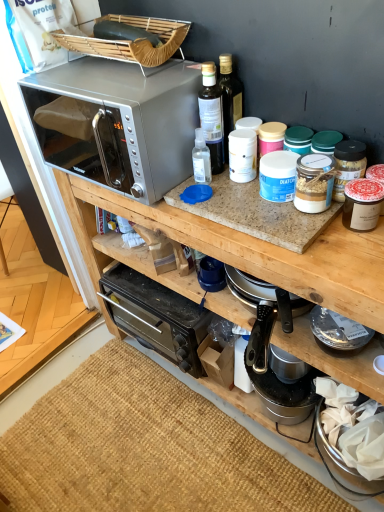
Find the location of a particular element. matte glass jar at right, which is the first appliance from top to bottom is located at coordinates tap(362, 204).

How much space does metallic silver coffee maker at center, which is the first appliance in back-to-front order, occupy horizontally?

metallic silver coffee maker at center, which is the first appliance in back-to-front order, is 8.22 inches in width.

Where is `metallic silver coffee maker at center, which ranks as the 2th appliance in top-to-bottom order`? The height and width of the screenshot is (512, 384). metallic silver coffee maker at center, which ranks as the 2th appliance in top-to-bottom order is located at coordinates (276, 376).

At what (x,y) coordinates should I click in order to perform the action: click on translucent glass bottle at upper center, marked as the second bottle in a left-to-right arrangement. Please return your answer as a coordinate pair (x, y). The image size is (384, 512). Looking at the image, I should click on (230, 98).

In order to click on satin silver microwave at upper left in this screenshot , I will do `click(117, 122)`.

Describe the element at coordinates (144, 449) in the screenshot. This screenshot has width=384, height=512. I see `burlap mat at lower center` at that location.

I want to click on matte glass jar at right, the first appliance positioned from the front, so pyautogui.click(x=362, y=204).

From the image's perspective, between satin silver microwave at upper left and matte glass jar at right, the second appliance from the back, which one is located above?

satin silver microwave at upper left appears higher in the image.

From a real-world perspective, is satin silver microwave at upper left below matte glass jar at right, which is the first appliance from top to bottom?

No, from a real-world perspective, satin silver microwave at upper left is not beneath matte glass jar at right, which is the first appliance from top to bottom.

Considering the positions of objects satin silver microwave at upper left and matte glass jar at right, positioned as the 2th appliance in bottom-to-top order, in the image provided, who is more to the left, satin silver microwave at upper left or matte glass jar at right, positioned as the 2th appliance in bottom-to-top order,?

satin silver microwave at upper left.

Does point (52, 101) appear closer or farther from the camera than point (361, 207)?

Point (52, 101).

Is silver metallic microwave at upper left completely or partially inside matte glass jar at right, the first appliance positioned from the front?

Definitely not — silver metallic microwave at upper left is not inside matte glass jar at right, the first appliance positioned from the front.

Who is taller, matte glass jar at right, the first appliance positioned from the front, or silver metallic microwave at upper left?

silver metallic microwave at upper left.

Which point is more forward, (374, 189) or (341, 362)?

The point (374, 189) is in front.

How much distance is there between matte glass jar at right, the first appliance positioned from the front, and silver metallic microwave at upper left?

They are 14.00 inches apart.

Is metallic silver coffee maker at center, which ranks as the 2th appliance in top-to-bottom order, positioned with its back to satin silver microwave at upper left?

That's not correct — metallic silver coffee maker at center, which ranks as the 2th appliance in top-to-bottom order, is not looking away from satin silver microwave at upper left.

Can you tell me how much metallic silver coffee maker at center, which is the 2th appliance from front to back, and satin silver microwave at upper left differ in facing direction?

The facing directions of metallic silver coffee maker at center, which is the 2th appliance from front to back, and satin silver microwave at upper left are 0.000352 degrees apart.

Is metallic silver coffee maker at center, which is the first appliance from bottom to top, located outside satin silver microwave at upper left?

Yes, metallic silver coffee maker at center, which is the first appliance from bottom to top, is outside of satin silver microwave at upper left.

Which object is closer to the camera taking this photo, metallic silver coffee maker at center, which is the first appliance in back-to-front order, or satin silver microwave at upper left?

satin silver microwave at upper left is closer to the camera.

From the image's perspective, between satin silver microwave at upper left and metallic silver coffee maker at center, which ranks as the 2th appliance in top-to-bottom order, which one is located above?

satin silver microwave at upper left is shown above in the image.

Where is `microwave oven lying on the left of metallic silver coffee maker at center, which is the first appliance from bottom to top`? This screenshot has width=384, height=512. microwave oven lying on the left of metallic silver coffee maker at center, which is the first appliance from bottom to top is located at coordinates (117, 122).

Is satin silver microwave at upper left turned away from metallic silver coffee maker at center, which ranks as the 2th appliance in top-to-bottom order?

No.

Considering the sizes of objects translucent glass bottle at upper center, which appears as the 1th bottle when viewed from the right, and satin silver microwave at upper left in the image provided, who is smaller, translucent glass bottle at upper center, which appears as the 1th bottle when viewed from the right, or satin silver microwave at upper left?

translucent glass bottle at upper center, which appears as the 1th bottle when viewed from the right, is smaller.

From the picture: Is translucent glass bottle at upper center, which appears as the 1th bottle when viewed from the right, turned away from satin silver microwave at upper left?

translucent glass bottle at upper center, which appears as the 1th bottle when viewed from the right, does not have its back to satin silver microwave at upper left.

Which of these two, translucent glass bottle at upper center, which appears as the 1th bottle when viewed from the right, or satin silver microwave at upper left, is thinner?

With smaller width is translucent glass bottle at upper center, which appears as the 1th bottle when viewed from the right.

In the scene shown: Is matte glass jar at right, the second appliance from the back, at the right side of translucent glass bottle at upper center, marked as the second bottle in a left-to-right arrangement?

Correct, you'll find matte glass jar at right, the second appliance from the back, to the right of translucent glass bottle at upper center, marked as the second bottle in a left-to-right arrangement.

Which point is more forward, [349,218] or [236,89]?

The point [349,218] is closer to the camera.

Is matte glass jar at right, the second appliance from the back, taller than translucent glass bottle at upper center, marked as the second bottle in a left-to-right arrangement?

A: No, matte glass jar at right, the second appliance from the back, is not taller than translucent glass bottle at upper center, marked as the second bottle in a left-to-right arrangement.

Is matte glass jar at right, the first appliance positioned from the front, inside or outside of translucent glass bottle at upper center, which appears as the 1th bottle when viewed from the right?

matte glass jar at right, the first appliance positioned from the front, exists outside the volume of translucent glass bottle at upper center, which appears as the 1th bottle when viewed from the right.

Is silver metallic microwave at upper left at the back of burlap mat at lower center?

No, burlap mat at lower center is not facing away from silver metallic microwave at upper left.

Is burlap mat at lower center positioned behind silver metallic microwave at upper left?

Yes, burlap mat at lower center is further from the camera.

Is burlap mat at lower center taller or shorter than silver metallic microwave at upper left?

Clearly, burlap mat at lower center is shorter compared to silver metallic microwave at upper left.

Considering the sizes of objects burlap mat at lower center and silver metallic microwave at upper left in the image provided, who is wider, burlap mat at lower center or silver metallic microwave at upper left?

burlap mat at lower center.

From the image's perspective, count 1st appliances downward from the satin silver microwave at upper left and point to it. Please provide its 2D coordinates.

[(362, 204)]

Image resolution: width=384 pixels, height=512 pixels. What are the coordinates of `cabinetry in front of the matte glass jar at right, the second appliance from the back` in the screenshot? It's located at (246, 248).

Which object lies nearer to the anchor point satin silver microwave at upper left, burlap mat at lower center or silver metallic microwave at upper left?

silver metallic microwave at upper left is closer to satin silver microwave at upper left.

When comparing their distances from translucent plastic spray bottle at upper center, placed as the 2th bottle when sorted from right to left, does satin silver microwave at upper left or burlap mat at lower center seem further?

Based on the image, burlap mat at lower center appears to be further to translucent plastic spray bottle at upper center, placed as the 2th bottle when sorted from right to left.

Estimate the real-world distances between objects in this image. Which object is further from silver metallic microwave at upper left, translucent plastic spray bottle at upper center, placed as the 2th bottle when sorted from right to left, or matte glass jar at right, which is the first appliance from top to bottom?

Among the two, translucent plastic spray bottle at upper center, placed as the 2th bottle when sorted from right to left, is located further to silver metallic microwave at upper left.

Based on the photo, based on their spatial positions, is silver metallic microwave at upper left or translucent plastic spray bottle at upper center, placed as the 2th bottle when sorted from right to left, closer to matte glass jar at right, which is the first appliance from top to bottom?

silver metallic microwave at upper left is positioned closer to the anchor matte glass jar at right, which is the first appliance from top to bottom.

Based on their spatial positions, is satin silver microwave at upper left or metallic silver coffee maker at center, which is the first appliance from bottom to top, closer to burlap mat at lower center?

metallic silver coffee maker at center, which is the first appliance from bottom to top, lies closer to burlap mat at lower center than the other object.

When comparing their distances from burlap mat at lower center, does translucent glass bottle at upper center, which appears as the 1th bottle when viewed from the right, or silver metallic microwave at upper left seem further?

translucent glass bottle at upper center, which appears as the 1th bottle when viewed from the right, lies further to burlap mat at lower center than the other object.

From the image, which object appears to be farther from matte glass jar at right, the first appliance positioned from the front, silver metallic microwave at upper left or burlap mat at lower center?

Among the two, burlap mat at lower center is located further to matte glass jar at right, the first appliance positioned from the front.

Considering their positions, is burlap mat at lower center positioned further to translucent glass bottle at upper center, marked as the second bottle in a left-to-right arrangement, than metallic silver coffee maker at center, which ranks as the 2th appliance in top-to-bottom order?

burlap mat at lower center lies further to translucent glass bottle at upper center, marked as the second bottle in a left-to-right arrangement, than the other object.

This screenshot has width=384, height=512. Identify the location of appliance between silver metallic microwave at upper left and burlap mat at lower center in the up-down direction. click(276, 376).

Locate an element on the screen. cabinetry between translucent plastic spray bottle at upper center, the 1th bottle from the left, and metallic silver coffee maker at center, which is the 2th appliance from front to back, from top to bottom is located at coordinates (246, 248).

Identify the location of appliance between translucent plastic spray bottle at upper center, placed as the 2th bottle when sorted from right to left, and metallic silver coffee maker at center, which is the first appliance from bottom to top, in the vertical direction. (362, 204).

The width and height of the screenshot is (384, 512). I want to click on appliance that lies between satin silver microwave at upper left and metallic silver coffee maker at center, which is the 2th appliance from front to back, from top to bottom, so click(x=362, y=204).